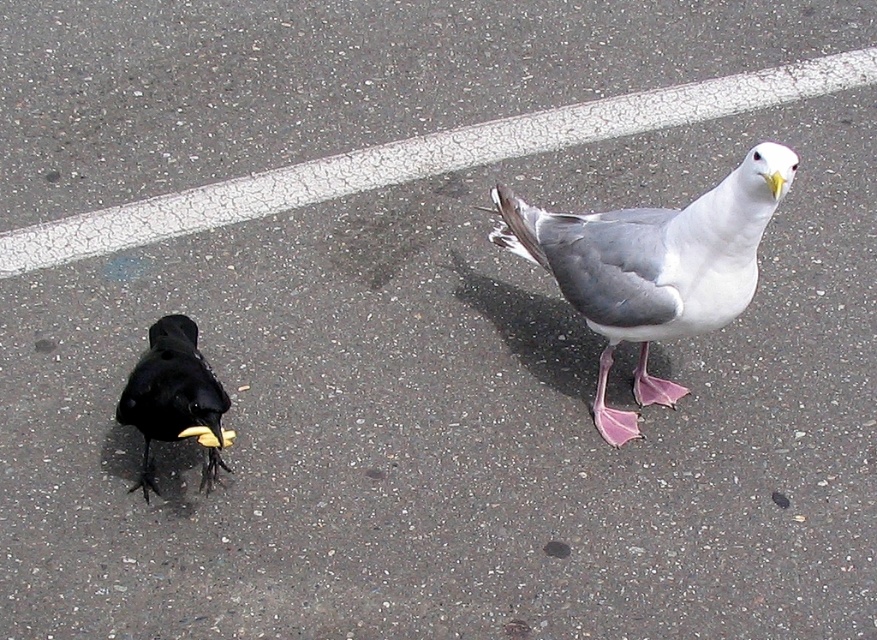
Does white matte/grey seagull at right appear on the right side of shiny black pigeon at lower left?

Indeed, white matte/grey seagull at right is positioned on the right side of shiny black pigeon at lower left.

Between point (728, 291) and point (173, 417), which one is positioned in front?

Point (728, 291)

The width and height of the screenshot is (877, 640). In order to click on white matte/grey seagull at right in this screenshot , I will do `click(653, 268)`.